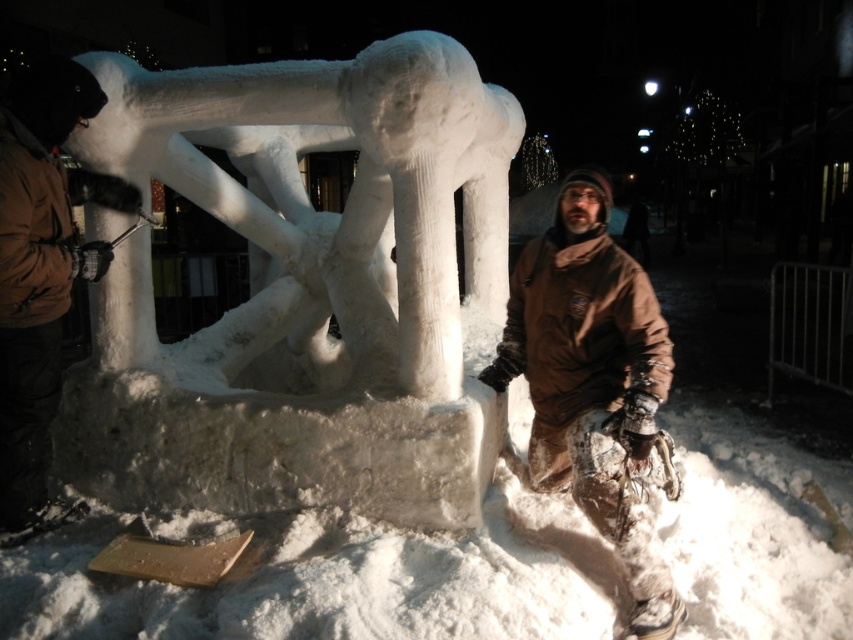
You are standing in front of the snow sculpture and want to move from the point at coordinates point (112, 330) to the point at coordinates point (558, 262). Which direction should you face to walk towards the second point?

Since point (112, 330) is closer to you than point (558, 262), you should face away from the sculpture to move towards the farther point. The direction would be towards the background of the scene.

You are standing in a park and see the white snow sculpture at center. If you take one step forward, will you be closer to the sculpture than 2.80 meters?

The white snow sculpture at center is currently 2.80 meters away. If you take one step forward, you will be closer than 2.80 meters to the sculpture.